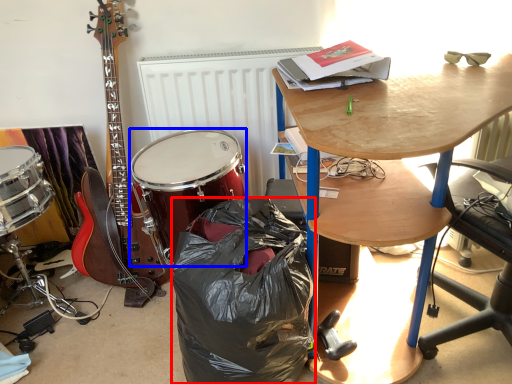
Question: Among these objects, which one is farthest to the camera, trash bin/can (highlighted by a red box) or drum (highlighted by a blue box)?

Choices:
 (A) trash bin/can
 (B) drum

Answer: (B)